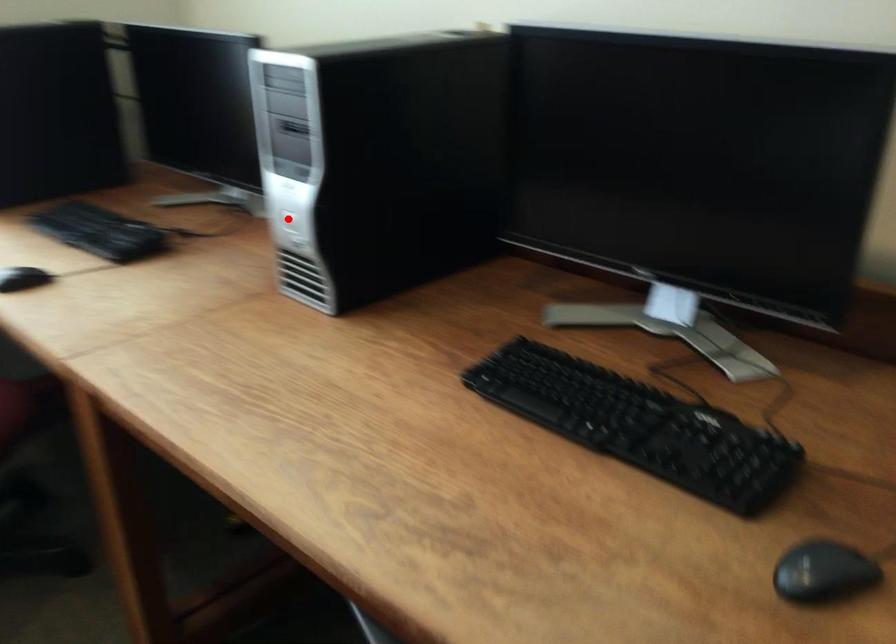
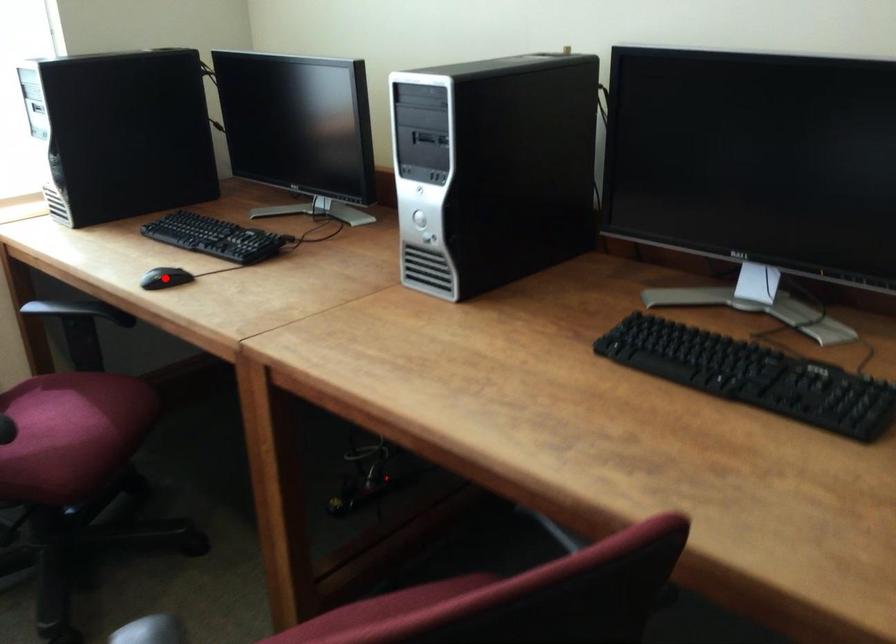
I am providing you with two images of the same scene from different viewpoints. A red point is marked on the first image and another point is marked on the second image. Do the highlighted points in image1 and image2 indicate the same real-world spot?

No